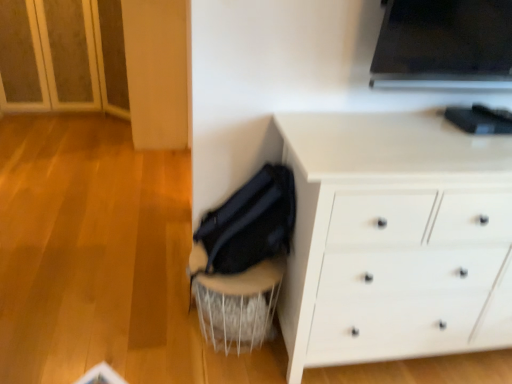
Question: Does velvet black swivel chair at lower center appear on the right side of white matte chest of drawers at lower right?

Choices:
 (A) no
 (B) yes

Answer: (A)

Question: Is velvet black swivel chair at lower center in front of white matte chest of drawers at lower right?

Choices:
 (A) no
 (B) yes

Answer: (A)

Question: Is velvet black swivel chair at lower center not close to white matte chest of drawers at lower right?

Choices:
 (A) yes
 (B) no

Answer: (B)

Question: From a real-world perspective, is velvet black swivel chair at lower center on white matte chest of drawers at lower right?

Choices:
 (A) no
 (B) yes

Answer: (A)

Question: Is velvet black swivel chair at lower center smaller than white matte chest of drawers at lower right?

Choices:
 (A) no
 (B) yes

Answer: (B)

Question: Considering the relative sizes of velvet black swivel chair at lower center and white matte chest of drawers at lower right in the image provided, is velvet black swivel chair at lower center wider than white matte chest of drawers at lower right?

Choices:
 (A) no
 (B) yes

Answer: (A)

Question: Is white matte chest of drawers at lower right in contact with velvet black swivel chair at lower center?

Choices:
 (A) no
 (B) yes

Answer: (A)

Question: Does white matte chest of drawers at lower right contain velvet black swivel chair at lower center?

Choices:
 (A) yes
 (B) no

Answer: (B)

Question: Is white matte chest of drawers at lower right positioned before velvet black swivel chair at lower center?

Choices:
 (A) no
 (B) yes

Answer: (B)

Question: Does white matte chest of drawers at lower right turn towards velvet black swivel chair at lower center?

Choices:
 (A) no
 (B) yes

Answer: (A)

Question: From the image's perspective, is white matte chest of drawers at lower right below velvet black swivel chair at lower center?

Choices:
 (A) no
 (B) yes

Answer: (A)

Question: From a real-world perspective, is white matte chest of drawers at lower right located beneath velvet black swivel chair at lower center?

Choices:
 (A) no
 (B) yes

Answer: (A)

Question: Considering the positions of white matte chest of drawers at lower right and velvet black swivel chair at lower center in the image, is white matte chest of drawers at lower right bigger or smaller than velvet black swivel chair at lower center?

Choices:
 (A) big
 (B) small

Answer: (A)